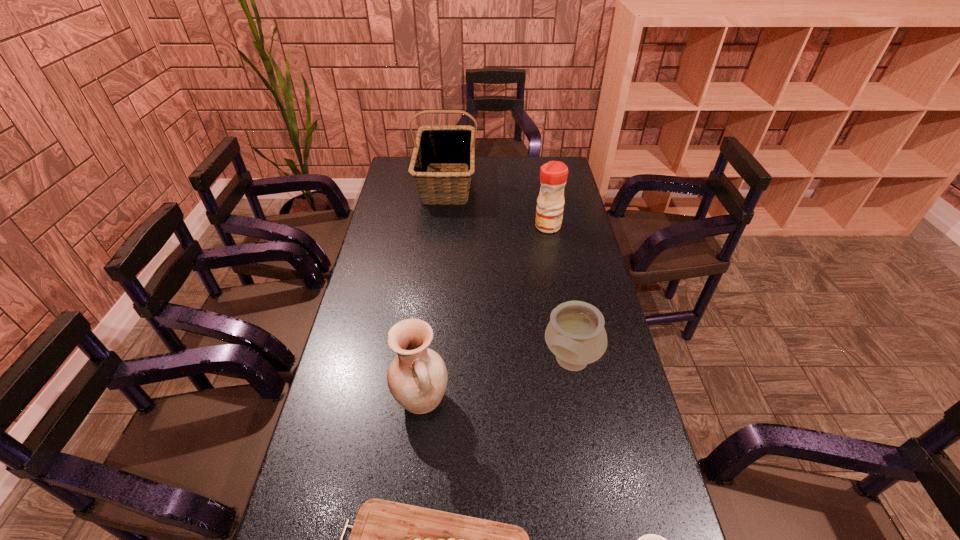
This screenshot has height=540, width=960. I want to click on vacant area that lies between the condiment and the taller pottery, so click(x=485, y=314).

At what (x,y) coordinates should I click in order to perform the action: click on free space between the right pottery and the left pottery. Please return your answer as a coordinate pair (x, y). The width and height of the screenshot is (960, 540). Looking at the image, I should click on point(496,382).

I want to click on empty space between the condiment and the taller pottery, so click(x=485, y=314).

This screenshot has height=540, width=960. What are the coordinates of `free space between the condiment and the fourth tallest object` in the screenshot? It's located at (560, 294).

Find the location of a particular element. vacant space that is in between the condiment and the basket is located at coordinates (497, 204).

You are a GUI agent. You are given a task and a screenshot of the screen. Output one action in this format:
    pyautogui.click(x=<x>, y=<y>)
    Task: Click on the object that is the fifth nearest to the basket
    The width and height of the screenshot is (960, 540).
    Given the screenshot: What is the action you would take?
    pyautogui.click(x=650, y=539)

Identify which object is located as the fifth nearest to the shorter pottery. Please provide its 2D coordinates. Your answer should be formatted as a tuple, i.e. [(x, y)], where the tuple contains the x and y coordinates of a point satisfying the conditions above.

[(437, 145)]

The height and width of the screenshot is (540, 960). What are the coordinates of `free space in the image that satisfies the following two spatial constraints: 1. on the back side of the third shortest object; 2. on the right side of the fifth nearest object` in the screenshot? It's located at pos(546,226).